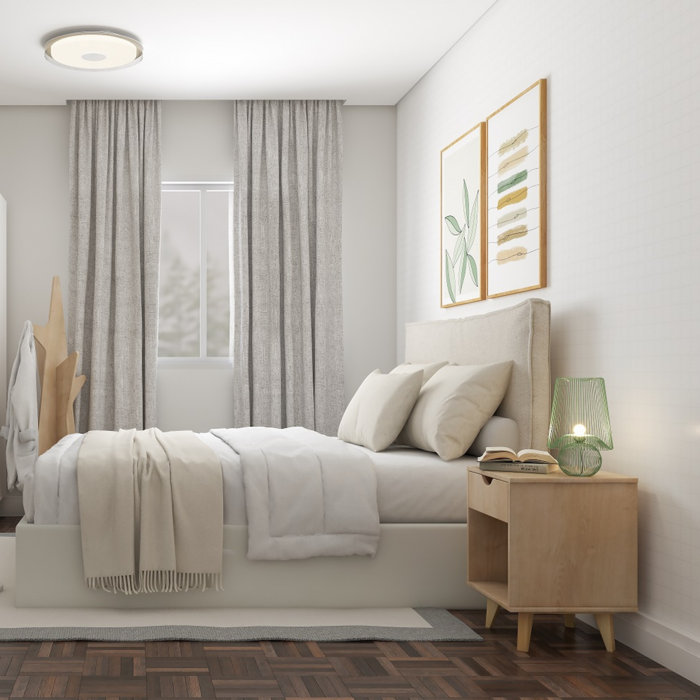
Find the location of a particular element. This screenshot has height=700, width=700. window frame is located at coordinates (173, 188), (231, 215), (204, 267), (202, 353), (167, 363), (225, 363), (222, 188).